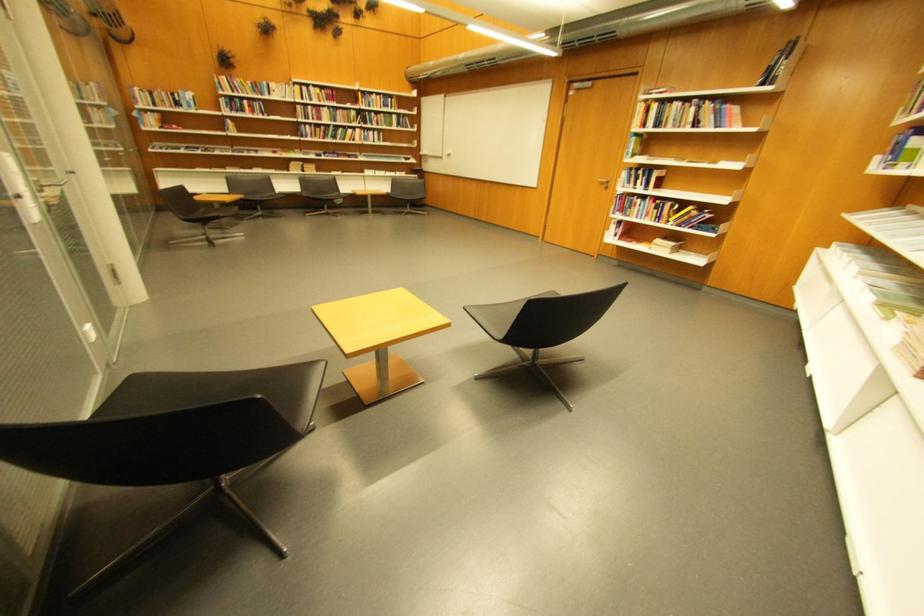
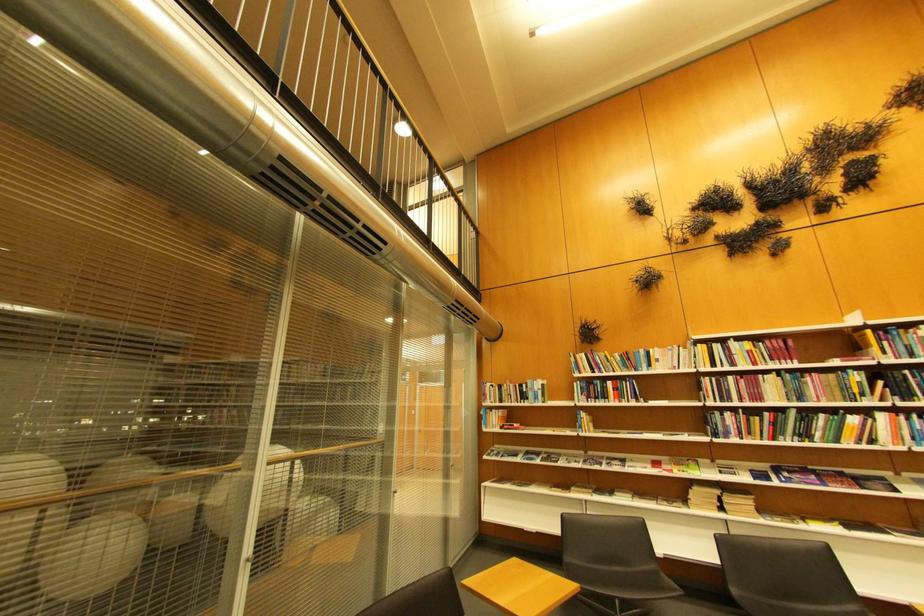
Find the pixel in the second image that matches pixel 190 94 in the first image.

(540, 383)